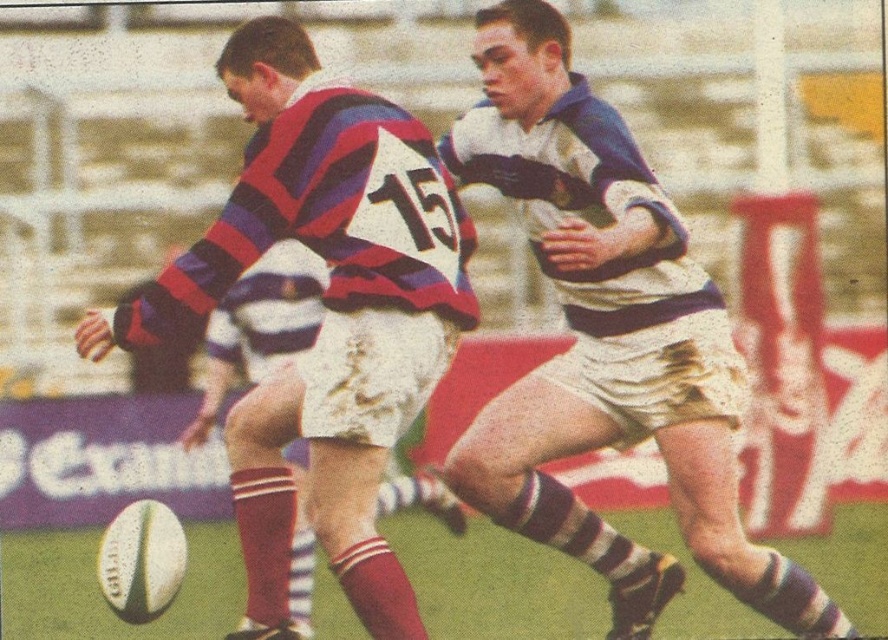
Question: Which point is closer to the camera?

Choices:
 (A) striped jersey at center
 (B) white textured shorts at center

Answer: (B)

Question: Observing the image, what is the correct spatial positioning of white textured shorts at center in reference to striped jersey at center?

Choices:
 (A) below
 (B) above

Answer: (A)

Question: Which point is closer to the camera taking this photo?

Choices:
 (A) (324, 177)
 (B) (532, 90)

Answer: (A)

Question: Considering the relative positions of white textured shorts at center and striped jersey at center in the image provided, where is white textured shorts at center located with respect to striped jersey at center?

Choices:
 (A) below
 (B) above

Answer: (A)

Question: Is white textured shorts at center above striped jersey at center?

Choices:
 (A) no
 (B) yes

Answer: (A)

Question: Which object is closer to the camera taking this photo?

Choices:
 (A) white textured shorts at center
 (B) striped jersey at center

Answer: (A)